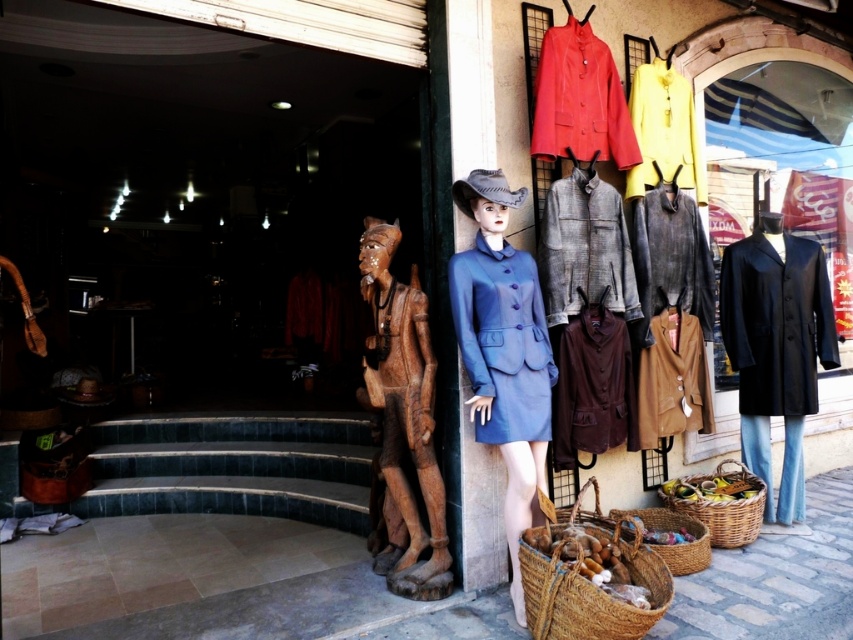
You are a customer entering the vintage clothing store and see the brown woven basket at lower center and the yellow wool coat at upper right. Which object is closer to you as you approach the store entrance?

The brown woven basket at lower center is closer to you because it is in front of the yellow wool coat at upper right.

You are standing at the entrance of the vintage clothing store. There is a point marked at coordinates point [770,340]. If you want to reach that point without moving your feet, can you just stretch your arm out to touch it?

The point [770,340] is 11.48 feet away from the viewer, which is farther than the average arm length of a person. Therefore, you cannot reach it without moving your feet.